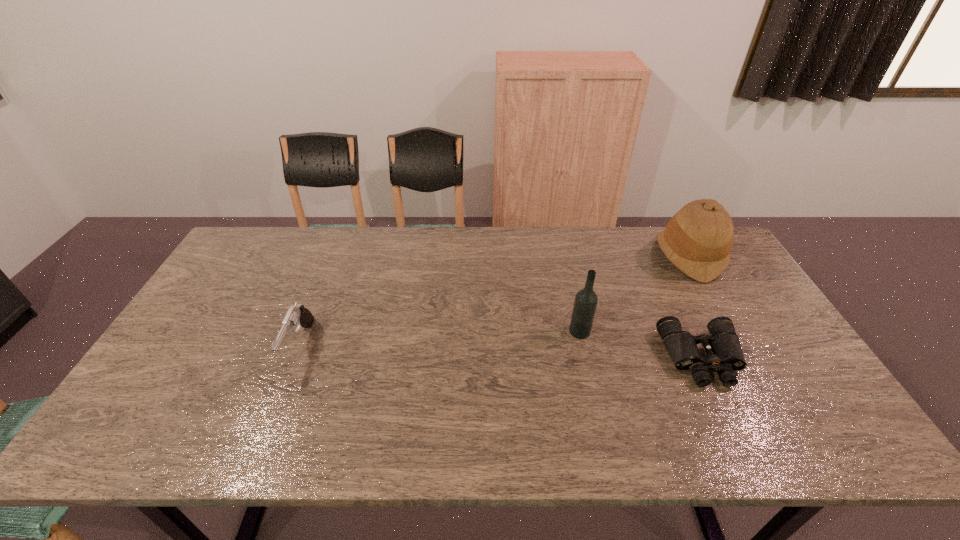
You are a GUI agent. You are given a task and a screenshot of the screen. Output one action in this format:
    pyautogui.click(x=<x>, y=<y>)
    Task: Click on the farthest object
    
    Given the screenshot: What is the action you would take?
    pyautogui.click(x=698, y=239)

I want to click on vodka, so click(586, 300).

At what (x,y) coordinates should I click in order to perform the action: click on gun. Please return your answer as a coordinate pair (x, y). Image resolution: width=960 pixels, height=540 pixels. Looking at the image, I should click on (297, 315).

I want to click on the leftmost object, so click(x=297, y=315).

Find the location of a particular element. Image resolution: width=960 pixels, height=540 pixels. the shortest object is located at coordinates (724, 353).

Locate an element on the screen. vacant space located 0.360m on the front-facing side of the hat is located at coordinates (550, 256).

In order to click on free spot located 0.140m on the front-facing side of the hat in this screenshot , I will do `click(614, 256)`.

This screenshot has height=540, width=960. In order to click on free location located on the front-facing side of the hat in this screenshot , I will do `click(553, 256)`.

The width and height of the screenshot is (960, 540). Find the location of `vacant space situated on the back of the second object from left to right`. vacant space situated on the back of the second object from left to right is located at coordinates (573, 304).

The image size is (960, 540). Identify the location of vacant space situated at the muzzle of the gun. [262, 440].